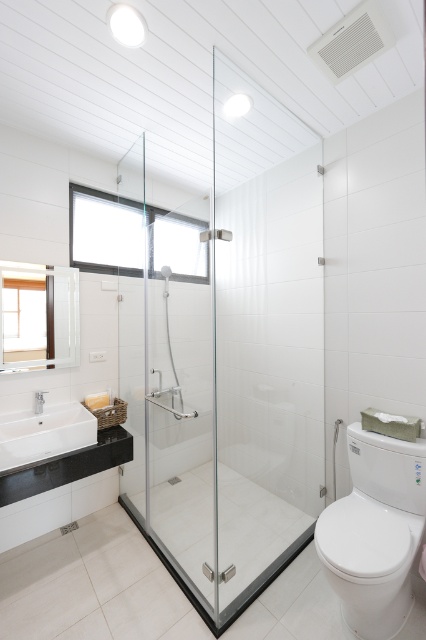
You are standing in the bathroom and want to enter the shower. Where should you approach to open the transparent glass shower door at center?

The transparent glass shower door at center is located at point [227,356], so you should approach that coordinate to open it.

You are a bathroom designer planning to install a new vanity cabinet between the transparent glass shower door at center and the white glossy toilet at right. Based on their positions, which side of the vanity cabinet should face the shower and which side should face the toilet?

The transparent glass shower door at center is positioned on the left side of the white glossy toilet at right. Therefore, the vanity cabinet should have its left side facing the shower and its right side facing the toilet.

You are a delivery person who just arrived at the bathroom and need to place a package that requires 1.7 meters of space to open. Can you safely open the package in front of the transparent glass shower door at center without it touching anything?

The transparent glass shower door at center and viewer are 1.68 meters apart, so the distance is slightly less than the required 1.7 meters. Therefore, you cannot safely open the package in front of the transparent glass shower door at center without it touching something.